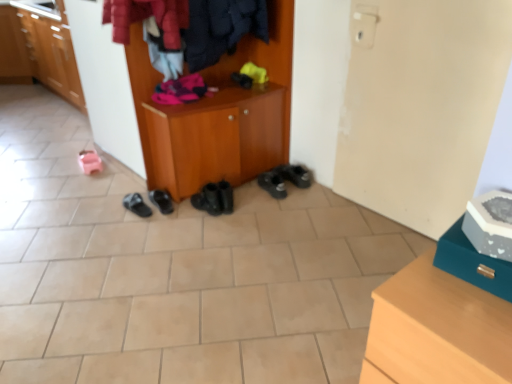
In order to click on free location in front of pink rubber sandals at lower left, which is the first footwear in left-to-right order in this screenshot , I will do `click(84, 174)`.